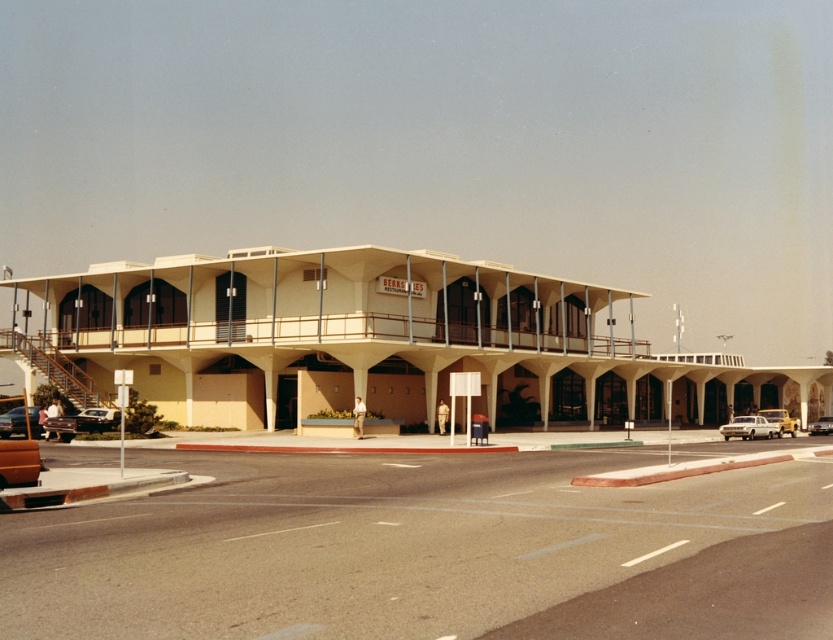
You are standing in front of the mid century modern building and want to take a photo of the beige concrete motel at center and the shiny black sedan at lower left. Which object should you focus on first to ensure it appears larger in your photo?

The beige concrete motel at center is closer to the viewer than the shiny black sedan at lower left, so focusing on it first will make it appear larger in the photo.

You are a delivery driver who needs to park your vehicle in the parking lot behind the building. The parking spot you want to use has a height restriction of 1.8 meters. Given the shiny silver sedan at lower left and the silver metallic sedan at center, which car is more likely to exceed the height limit?

The silver metallic sedan at center is taller than the shiny silver sedan at lower left, so it is more likely to exceed the 1.8 meter height restriction.

You are standing at the entrance of the BERKS building and want to check if your car, which is parked at the lower left, is within a 40 meters safety zone. Can you confirm if the shiny silver sedan at lower left is within the safety zone?

The shiny silver sedan at lower left is 39.05 meters away from the viewer, which is within the 40 meters safety zone.